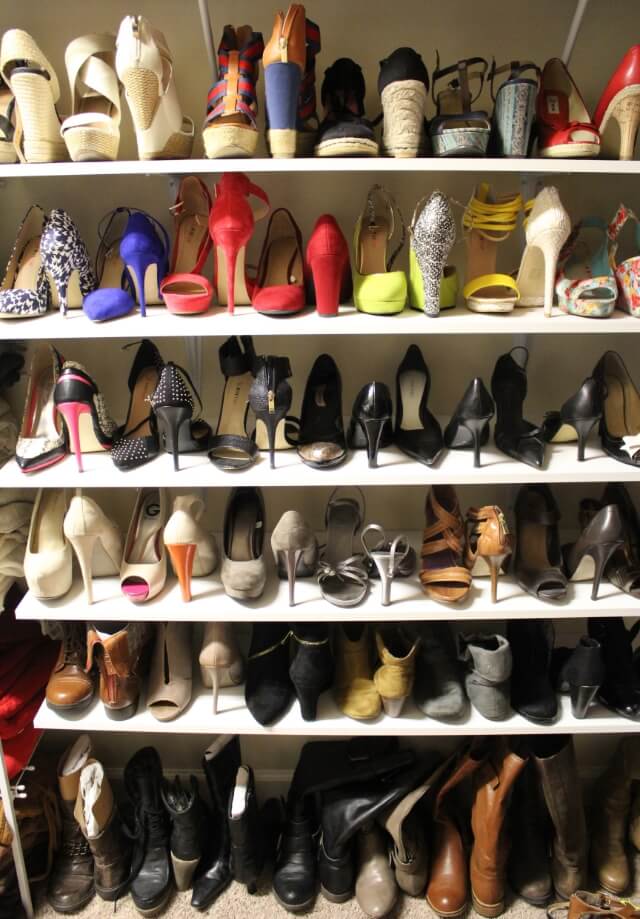
This screenshot has height=919, width=640. In order to click on shelves in this screenshot , I will do `click(236, 729)`, `click(232, 617)`, `click(244, 479)`, `click(272, 326)`, `click(276, 162)`.